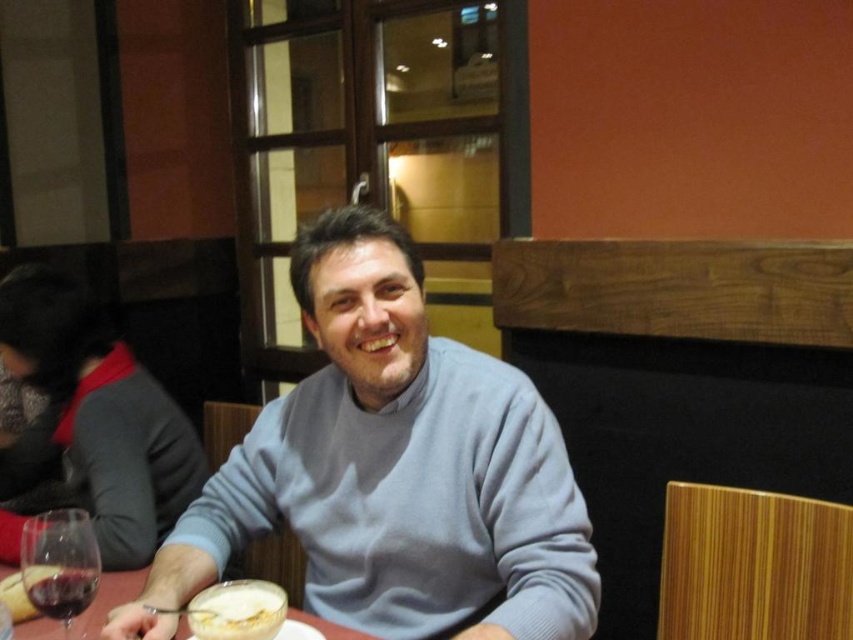
Question: Which of the following is the farthest from the observer?

Choices:
 (A) translucent glass at lower left
 (B) clear glass table at lower left

Answer: (B)

Question: Observing the image, what is the correct spatial positioning of white creamy soup at lower center in reference to translucent glass at lower left?

Choices:
 (A) above
 (B) below

Answer: (B)

Question: Where is white creamy soup at lower center located in relation to translucent glass at lower left in the image?

Choices:
 (A) above
 (B) below

Answer: (B)

Question: Which object is positioned farthest from the translucent glass at lower left?

Choices:
 (A) clear glass table at lower left
 (B) transparent glass at lower left
 (C) white creamy soup at lower center

Answer: (A)

Question: Is light blue sweater at center above clear glass table at lower left?

Choices:
 (A) yes
 (B) no

Answer: (A)

Question: Which object is farther from the camera taking this photo?

Choices:
 (A) white creamy soup at lower center
 (B) clear glass table at lower left

Answer: (B)